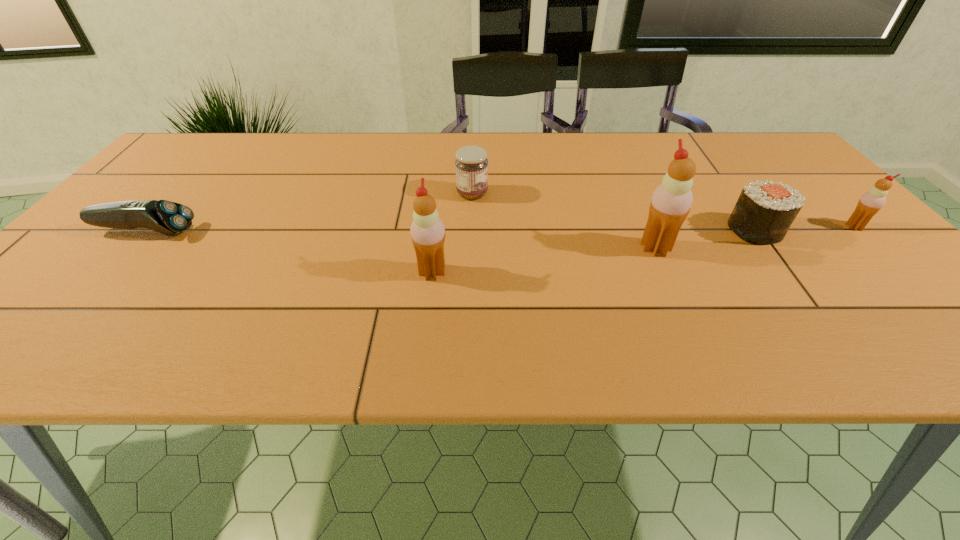
You are a GUI agent. You are given a task and a screenshot of the screen. Output one action in this format:
    pyautogui.click(x=<x>, y=<y>)
    Task: Click on the second shortest icecream
    This screenshot has height=540, width=960.
    Given the screenshot: What is the action you would take?
    pyautogui.click(x=427, y=230)

Where is `the nearest icecream`? This screenshot has width=960, height=540. the nearest icecream is located at coordinates (427, 230).

Locate an element on the screen. The image size is (960, 540). the second icecream from right to left is located at coordinates (670, 204).

Identify the location of the second nearest icecream. The height and width of the screenshot is (540, 960). (670, 204).

This screenshot has width=960, height=540. What are the coordinates of `the rightmost object` in the screenshot? It's located at (871, 202).

Locate an element on the screen. The width and height of the screenshot is (960, 540). the third tallest object is located at coordinates (871, 202).

Locate an element on the screen. This screenshot has width=960, height=540. jam is located at coordinates (471, 165).

Identify the location of the fourth object from right to left. The image size is (960, 540). (471, 165).

Find the location of a particular element. the shortest object is located at coordinates (166, 217).

This screenshot has width=960, height=540. Identify the location of the leftmost object. (166, 217).